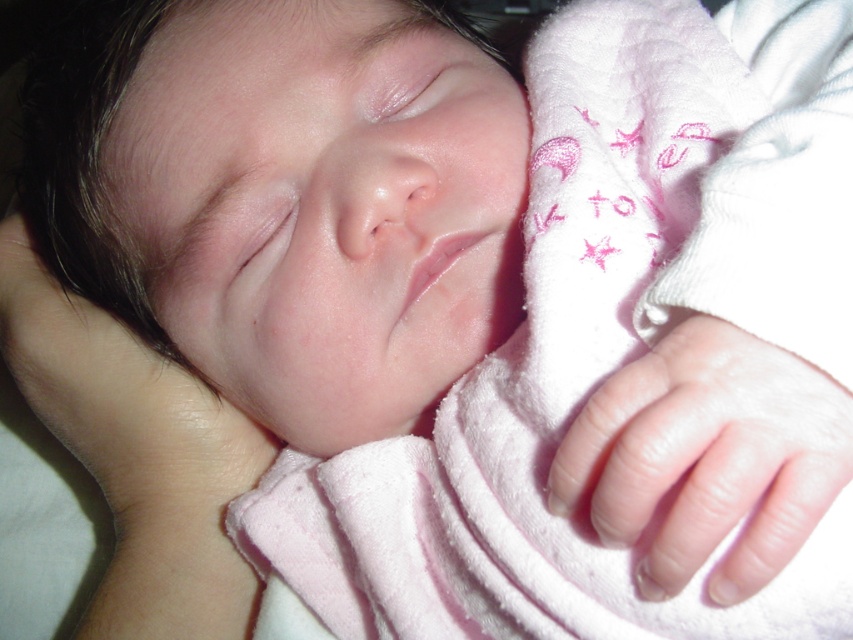
You are a photographer taking a close up of the baby. You need to focus on the smooth skin baby at center and the smooth skin hand at lower right. Which one should you focus on first to ensure it is sharp in the photo?

The smooth skin baby at center should be focused on first because it is closer to the viewer than the smooth skin hand at lower right, ensuring it appears sharp in the photo.

You are a photographer taking a close up of a baby. You notice the pink soft blanket at center and the smooth skin baby at center. Which object is taller in the image?

The pink soft blanket at center is taller than the smooth skin baby at center.

You are a photographer taking a close up of a baby. You need to ensure that the pink soft blanket at center and the smooth skin hand at lower right are both visible in the frame. Given their sizes, which object should you focus on to make sure both are fully visible?

The pink soft blanket at center has a greater height compared to the smooth skin hand at lower right. To ensure both are fully visible, focus on the pink soft blanket at center since it takes up more vertical space, allowing the smaller smooth skin hand at lower right to fit within the frame.